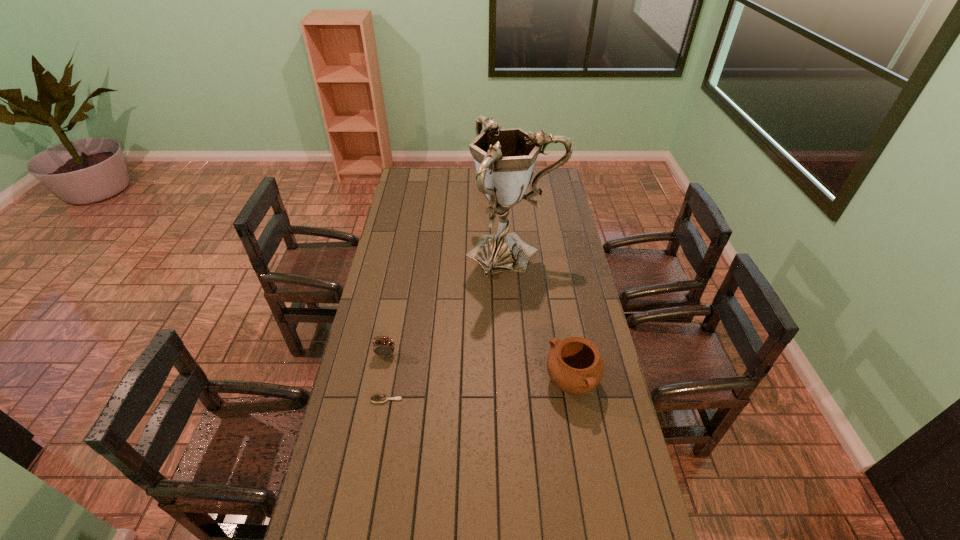
The height and width of the screenshot is (540, 960). What are the coordinates of `free area in between the third tallest object and the shortest object` in the screenshot? It's located at (479, 392).

I want to click on free point between the second tallest object and the shortest object, so click(x=441, y=289).

Where is `vacant space that is in between the farthest object and the third shortest object`? vacant space that is in between the farthest object and the third shortest object is located at coordinates 533,281.

In order to click on unoccupied area between the third tallest object and the shortest object in this screenshot , I will do `click(479, 392)`.

In order to click on free area in between the pottery and the second tallest object in this screenshot , I will do `click(533, 281)`.

This screenshot has height=540, width=960. Identify the location of free area in between the tallest object and the second shortest object. (449, 304).

At what (x,y) coordinates should I click in order to perform the action: click on free space between the third shortest object and the second tallest object. Please return your answer as a coordinate pair (x, y). The image size is (960, 540). Looking at the image, I should click on (533, 281).

I want to click on free area in between the pottery and the scrubbing brush, so click(x=479, y=392).

This screenshot has height=540, width=960. Find the location of `free space between the third tallest object and the shortest object`. free space between the third tallest object and the shortest object is located at coordinates (479, 392).

Point out which object is positioned as the third nearest to the second farthest object. Please provide its 2D coordinates. Your answer should be formatted as a tuple, i.e. [(x, y)], where the tuple contains the x and y coordinates of a point satisfying the conditions above.

[(384, 347)]